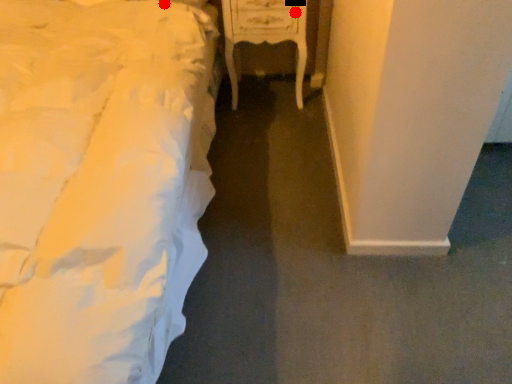
Question: Two points are circled on the image, labeled by A and B beside each circle. Among these points, which one is farthest from the camera?

Choices:
 (A) A is further
 (B) B is further

Answer: (B)